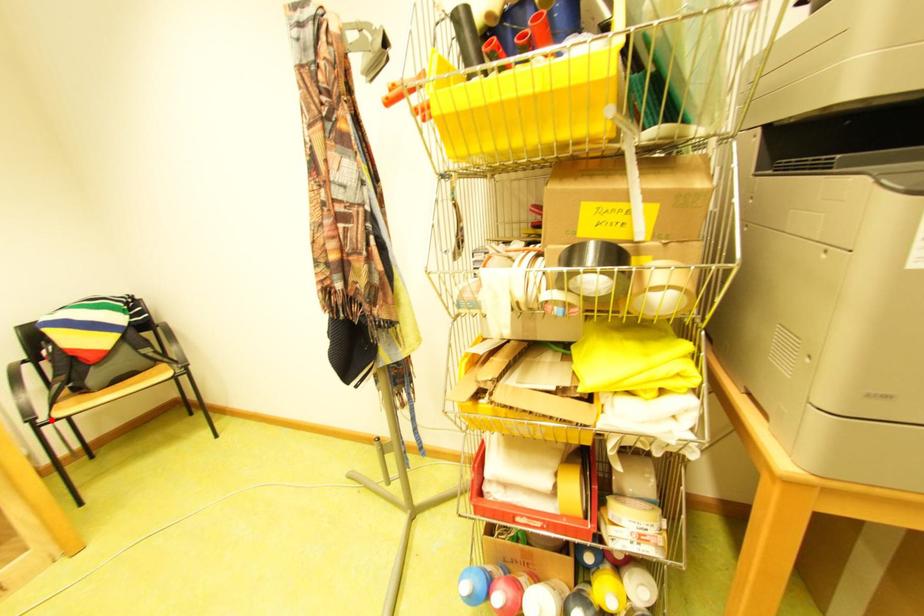
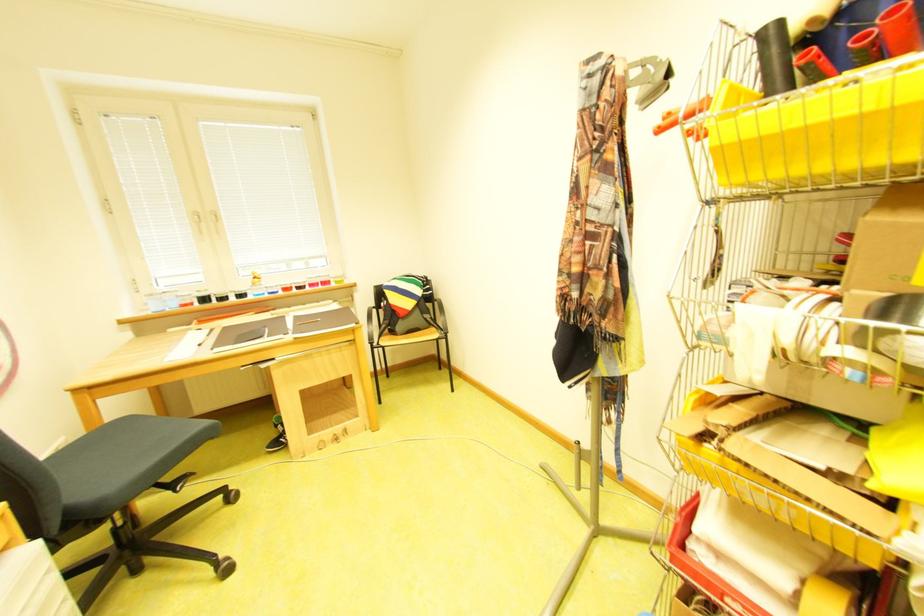
Question: A red point is marked in image1. In image2, is the corresponding 3D point closer to the camera or farther? Reply with the corresponding letter.

Choices:
 (A) The corresponding 3D point is closer.
 (B) The corresponding 3D point is farther.

Answer: (A)